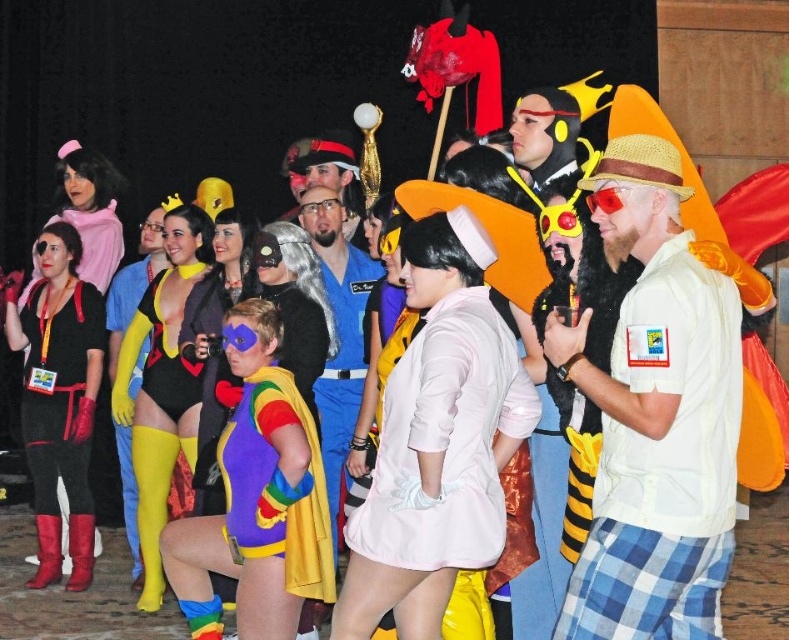
You are a photographer at the event and want to capture a clear photo of the rainbow fabric superhero suit at center and the yellow spandex suit at center. Since both are in the center, which one will appear larger in the photo?

The rainbow fabric superhero suit at center will appear larger in the photo because it is closer to the viewer than the yellow spandex suit at center.

You are a photographer at the event and want to capture a photo that includes both the beige cotton shirt at center and the matte black costume at left. Based on their positions, which one should you position on the right side of the frame to ensure both are visible?

The beige cotton shirt at center is already positioned to the right of the matte black costume at left. To include both in the photo, you should keep the beige cotton shirt at center on the right side of the frame since it is naturally positioned to the right of the matte black costume at left.

You are a photographer at the event and need to capture a photo that includes both the beige cotton shirt at center and the matte black costume at left. The camera you have can focus on objects within a 5 meter range. Will both subjects be in focus?

The beige cotton shirt at center is 6.22 meters from matte black costume at left. Since the camera can only focus within 5 meters, the distance between them exceeds the focus range. Therefore, both subjects cannot be in focus simultaneously.